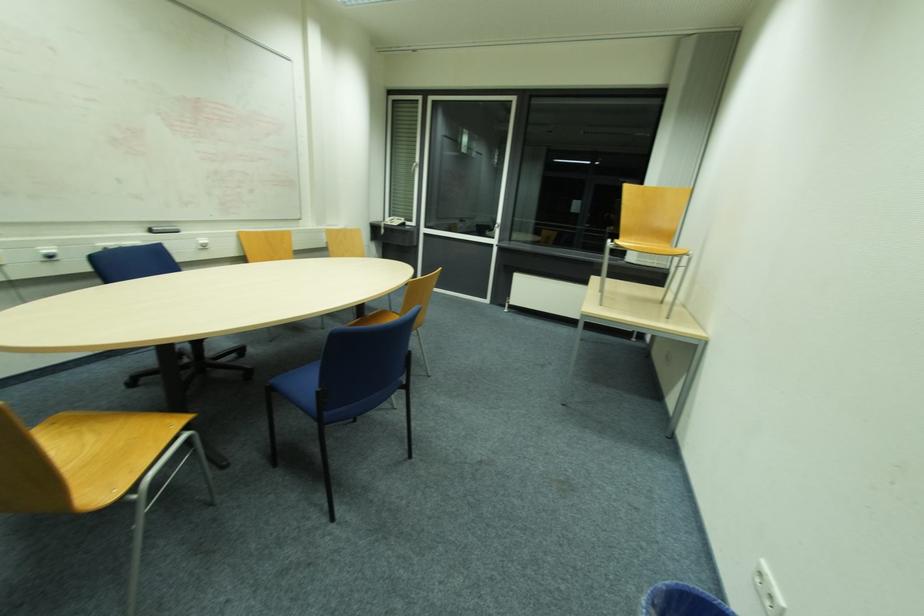
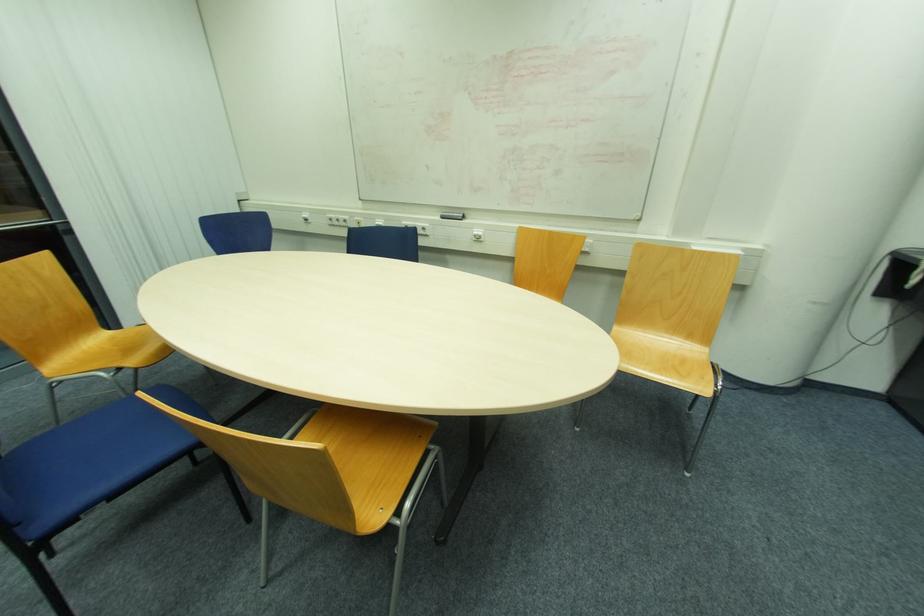
Locate, in the second image, the point that corresponds to (203,243) in the first image.

(477, 233)